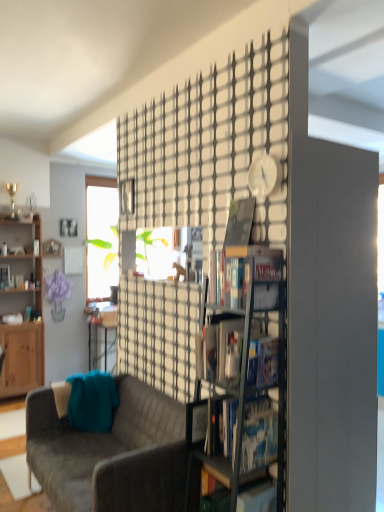
Question: Is hardcover book at center, the fifth book when ordered from right to left, surrounding hardcover book at center, marked as the second book in a bottom-to-top arrangement?

Choices:
 (A) yes
 (B) no

Answer: (B)

Question: Is hardcover book at center, the 1th book when ordered from front to back, not close to hardcover book at center, the 5th book in the back-to-front sequence?

Choices:
 (A) yes
 (B) no

Answer: (B)

Question: Is hardcover book at center, the fifth book when ordered from right to left, smaller than hardcover book at center, the 3th book in the left-to-right sequence?

Choices:
 (A) yes
 (B) no

Answer: (B)

Question: Can you confirm if hardcover book at center, which is the sixth book in back-to-front order, is positioned to the right of hardcover book at center, the 5th book in the back-to-front sequence?

Choices:
 (A) yes
 (B) no

Answer: (B)

Question: Does hardcover book at center, the 6th book positioned from the top, have a larger size compared to hardcover book at center, placed as the 4th book when sorted from right to left?

Choices:
 (A) no
 (B) yes

Answer: (B)

Question: In the image, is matte black bookshelf at center, which ranks as the 3th book in bottom-to-top order, on the left side or the right side of matte black bookshelf at left, which ranks as the 3th book in top-to-bottom order?

Choices:
 (A) right
 (B) left

Answer: (A)

Question: From a real-world perspective, is matte black bookshelf at center, which ranks as the 3th book in bottom-to-top order, above or below matte black bookshelf at left, which ranks as the 3th book in top-to-bottom order?

Choices:
 (A) above
 (B) below

Answer: (B)

Question: From their relative heights in the image, would you say matte black bookshelf at center, acting as the third book starting from the front, is taller or shorter than matte black bookshelf at left, which appears as the 4th book when ordered from the bottom?

Choices:
 (A) short
 (B) tall

Answer: (B)

Question: Looking at their shapes, would you say matte black bookshelf at center, the fourth book from the back, is wider or thinner than matte black bookshelf at left, the 6th book positioned from the front?

Choices:
 (A) wide
 (B) thin

Answer: (A)

Question: Which is correct: wooden bookcase at left is inside matte black bookshelf at left, which ranks as the 3th book in top-to-bottom order, or outside of it?

Choices:
 (A) outside
 (B) inside

Answer: (A)

Question: From the image's perspective, is wooden bookcase at left positioned above or below matte black bookshelf at left, which ranks as the 3th book in top-to-bottom order?

Choices:
 (A) above
 (B) below

Answer: (B)

Question: From a real-world perspective, is wooden bookcase at left above or below matte black bookshelf at left, the 6th book positioned from the front?

Choices:
 (A) below
 (B) above

Answer: (A)

Question: Is wooden bookcase at left wider or thinner than matte black bookshelf at left, which ranks as the 3th book in top-to-bottom order?

Choices:
 (A) wide
 (B) thin

Answer: (A)

Question: From a real-world perspective, is matte black magazine at center physically located above or below hardcover book at center, the 4th book when ordered from front to back?

Choices:
 (A) below
 (B) above

Answer: (B)

Question: Considering the positions of matte black magazine at center and hardcover book at center, the second book viewed from the right, in the image, is matte black magazine at center taller or shorter than hardcover book at center, the second book viewed from the right,?

Choices:
 (A) short
 (B) tall

Answer: (A)